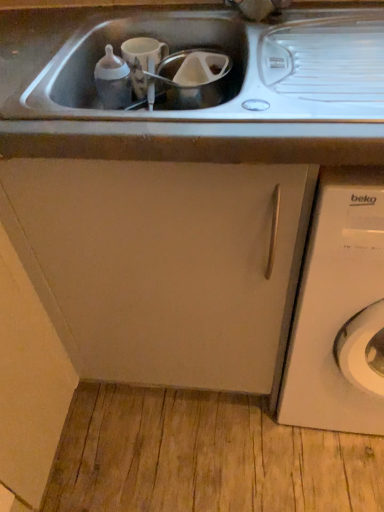
Question: Is white matte washing machine at right spatially inside matte white cabinet at center, or outside of it?

Choices:
 (A) inside
 (B) outside

Answer: (B)

Question: Considering the positions of white matte washing machine at right and matte white cabinet at center in the image, is white matte washing machine at right bigger or smaller than matte white cabinet at center?

Choices:
 (A) small
 (B) big

Answer: (A)

Question: Considering the positions of white matte washing machine at right and matte white cabinet at center in the image, is white matte washing machine at right taller or shorter than matte white cabinet at center?

Choices:
 (A) tall
 (B) short

Answer: (A)

Question: From the image's perspective, relative to white matte washing machine at right, is matte white cabinet at center above or below?

Choices:
 (A) above
 (B) below

Answer: (A)

Question: Considering the positions of matte white cabinet at center and white matte washing machine at right in the image, is matte white cabinet at center bigger or smaller than white matte washing machine at right?

Choices:
 (A) small
 (B) big

Answer: (B)

Question: From a real-world perspective, is matte white cabinet at center physically located above or below white matte washing machine at right?

Choices:
 (A) below
 (B) above

Answer: (B)

Question: Considering the positions of matte white cabinet at center and white matte washing machine at right in the image, is matte white cabinet at center taller or shorter than white matte washing machine at right?

Choices:
 (A) short
 (B) tall

Answer: (A)